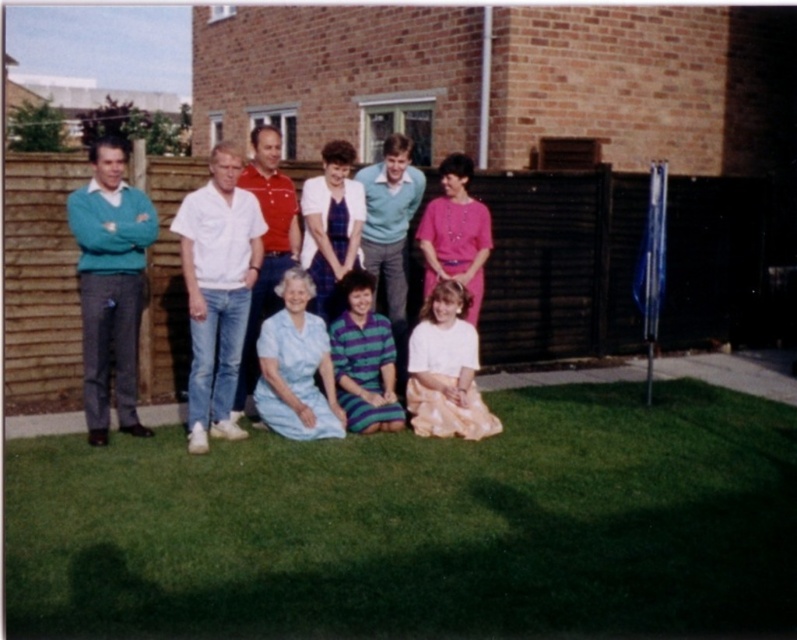
Does green grass at lower center appear on the left side of matte blue dress at center?

Incorrect, green grass at lower center is not on the left side of matte blue dress at center.

Does green grass at lower center have a greater height compared to matte blue dress at center?

In fact, green grass at lower center may be shorter than matte blue dress at center.

I want to click on green grass at lower center, so click(x=421, y=525).

Find the location of `green grass at lower center`. green grass at lower center is located at coordinates (421, 525).

Which is above, matte blue dress at center or teal knit sweater at left?

matte blue dress at center is higher up.

Is point (248, 211) more distant than point (132, 276)?

Yes, it is behind point (132, 276).

The image size is (797, 640). In order to click on matte blue dress at center in this screenshot , I will do `click(226, 280)`.

Find the location of a particular element. This screenshot has height=640, width=797. matte blue dress at center is located at coordinates (226, 280).

Is point (754, 570) closer to camera compared to point (97, 356)?

That is True.

Does green grass at lower center have a smaller size compared to teal knit sweater at left?

Correct, green grass at lower center occupies less space than teal knit sweater at left.

Is point (389, 484) more distant than point (100, 282)?

No, (389, 484) is in front of (100, 282).

Where is `green grass at lower center`? green grass at lower center is located at coordinates (421, 525).